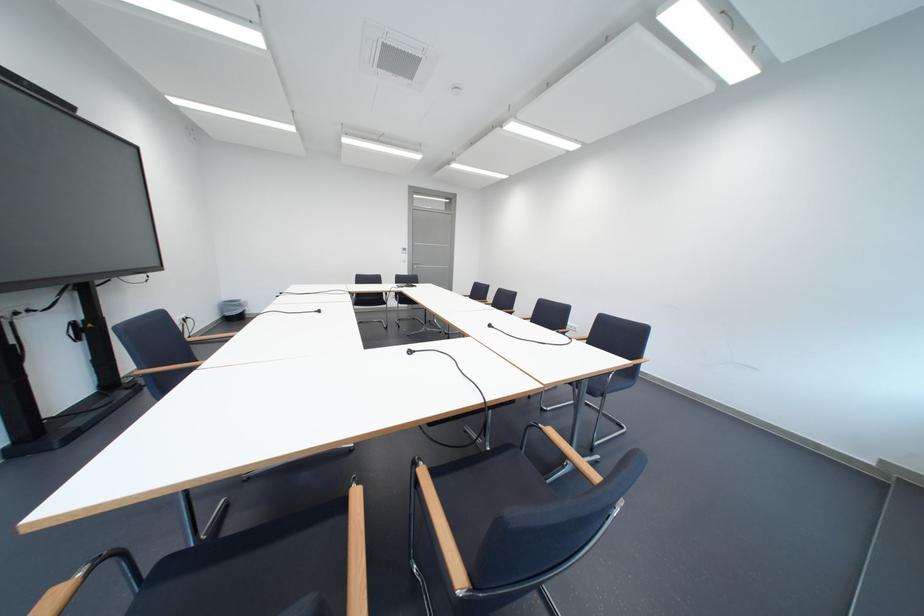
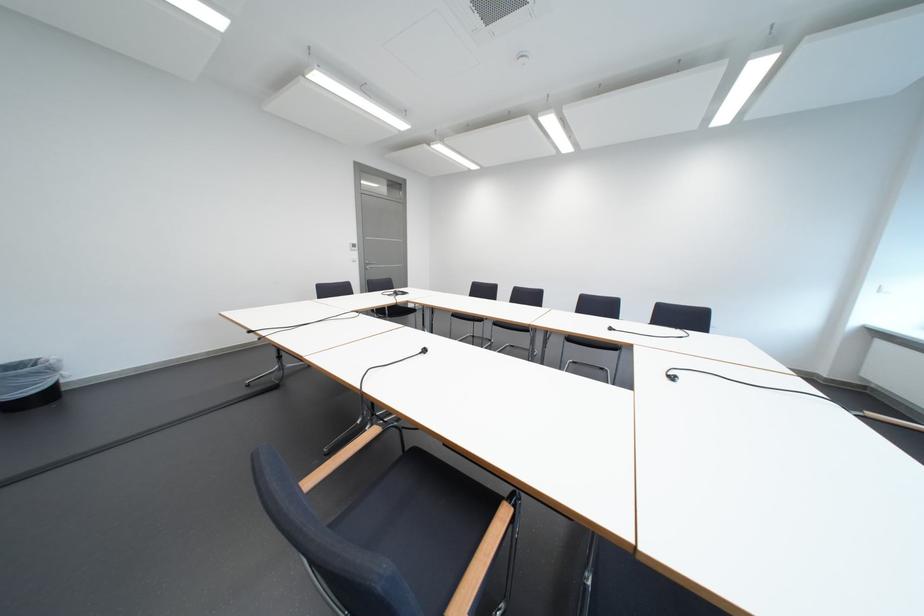
The images are taken continuously from a first-person perspective. In which direction are you moving?

The cameraman walked toward left, forward.